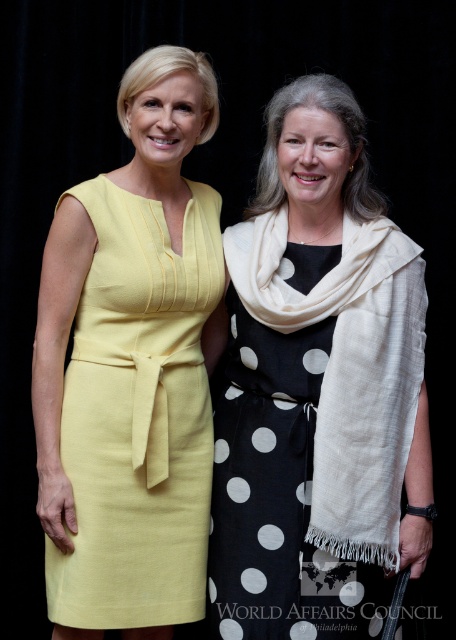
Does matte yellow dress at left have a greater width compared to black dotted dress at center?

Incorrect, matte yellow dress at left's width does not surpass black dotted dress at center's.

Can you confirm if matte yellow dress at left is thinner than black dotted dress at center?

Indeed, matte yellow dress at left has a lesser width compared to black dotted dress at center.

Does point (184, 620) come behind point (213, 628)?

Yes, it is.

The height and width of the screenshot is (640, 456). In order to click on matte yellow dress at left in this screenshot , I will do `click(139, 417)`.